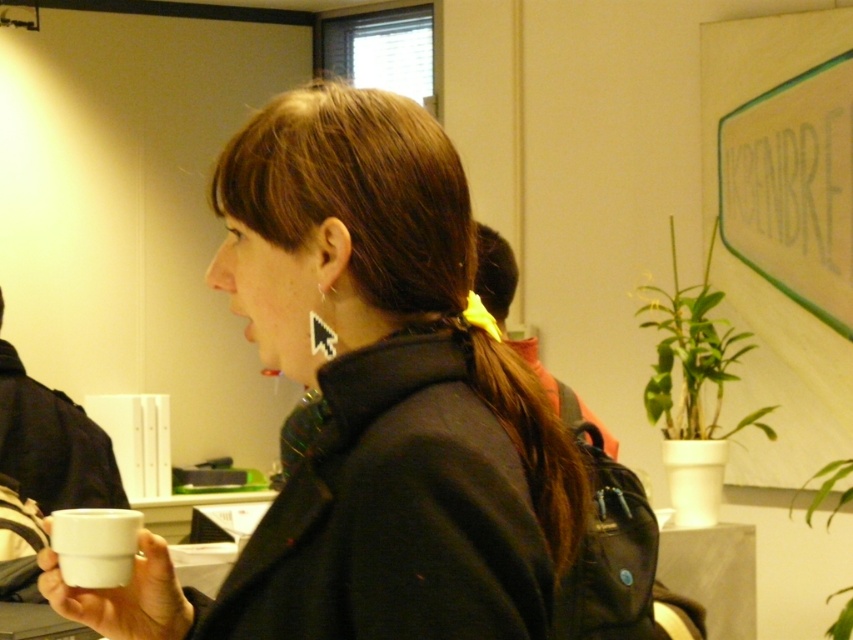
You are setting up a coffee station and need to place the white matte cup at center and the white matte mug at lower left on a shelf. If the shelf has limited width, which item should you place first to ensure both fit?

The white matte mug at lower left is narrower than the white matte cup at center, so place the wider cup first to accommodate both items on the shelf.

You are a barista who needs to serve a customer. You have two options in the image, a white matte cup at center and a white matte mug at lower left. Which one is taller?

The white matte cup at center is taller than the white matte mug at lower left according to the description.

You are a barista who needs to place the white matte cup at center and the white matte mug at lower left on a shelf. The shelf is 12 inches long. Can both items fit side by side on the shelf without overlapping?

The white matte cup at center is 11.10 inches away from the white matte mug at lower left. Since the shelf is 12 inches long, there is enough space to place both items side by side without overlapping as the total distance between them is less than the shelf length.